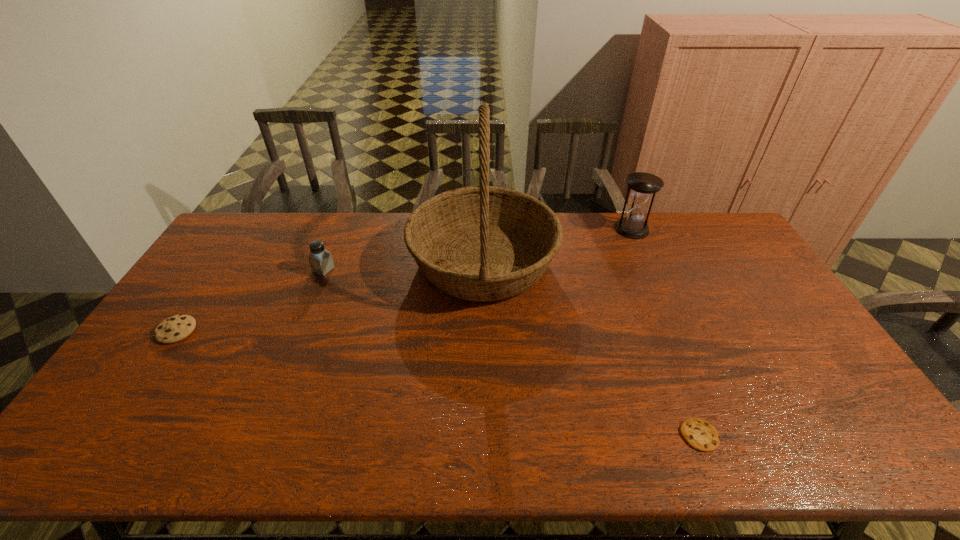
Identify the location of the tallest object. (482, 243).

In order to click on basket in this screenshot , I will do `click(482, 243)`.

Identify the location of the second tallest object. (644, 186).

You are a GUI agent. You are given a task and a screenshot of the screen. Output one action in this format:
    pyautogui.click(x=<x>, y=<y>)
    Task: Click on the fourth object from right to left
    
    Given the screenshot: What is the action you would take?
    pyautogui.click(x=321, y=262)

This screenshot has height=540, width=960. I want to click on saltshaker, so click(321, 262).

Locate an element on the screen. Image resolution: width=960 pixels, height=540 pixels. the taller cookie is located at coordinates (176, 328).

Find the location of `the leftmost object`. the leftmost object is located at coordinates (176, 328).

I want to click on the shortest object, so click(x=700, y=434).

Where is `the right cookie`? The image size is (960, 540). the right cookie is located at coordinates (700, 434).

Locate an element on the screen. The height and width of the screenshot is (540, 960). free spot located on the front of the tallest object is located at coordinates (484, 364).